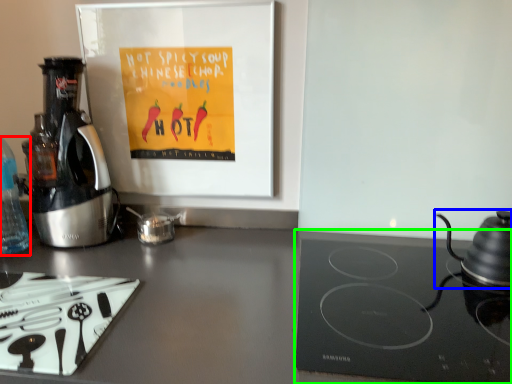
Question: Which is farther away from bottle (highlighted by a red box)? kitchen appliance (highlighted by a blue box) or gas stove (highlighted by a green box)?

Choices:
 (A) kitchen appliance
 (B) gas stove

Answer: (A)